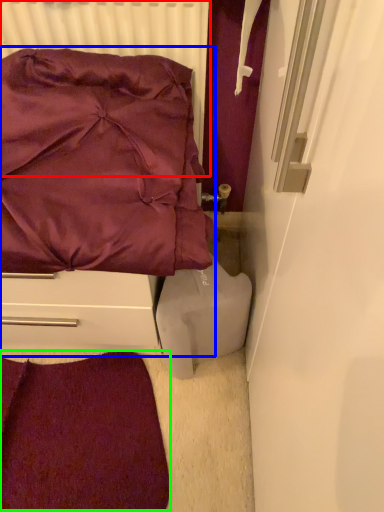
Question: Which object is positioned closest to radiator (highlighted by a red box)? Select from furniture (highlighted by a blue box) and violet (highlighted by a green box).

Choices:
 (A) furniture
 (B) violet

Answer: (A)